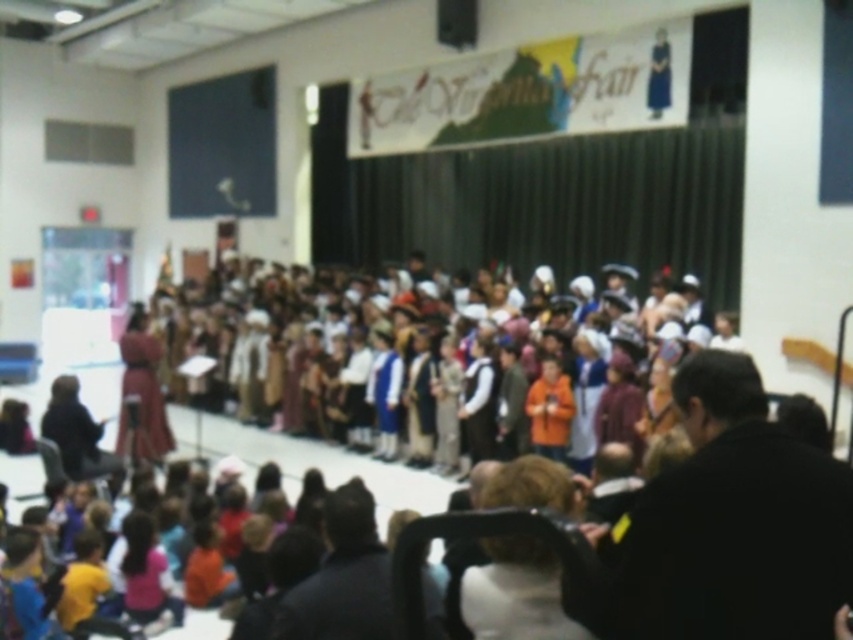
You are sitting in the audience at the school performance and want to quickly grab your dark brown leather jacket at lower right before the show ends. However, there is a dark fabric chair at lower left in the way. Can you reach your jacket without moving the chair?

The dark brown leather jacket at lower right is closer to the viewer than the dark fabric chair at lower left, so you can reach the jacket without needing to move the chair.